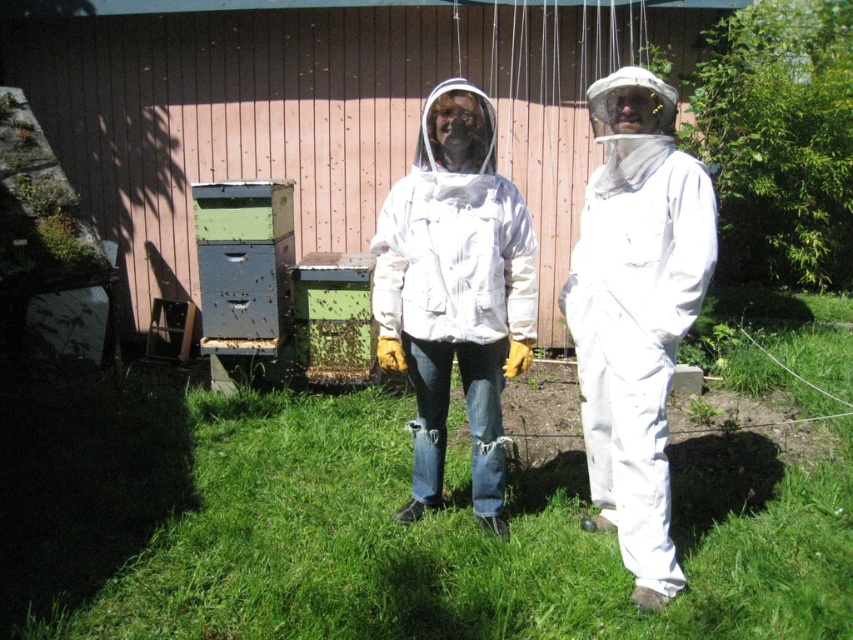
Image resolution: width=853 pixels, height=640 pixels. Describe the element at coordinates (636, 314) in the screenshot. I see `white matte bee suit at center` at that location.

I want to click on white matte bee suit at center, so pyautogui.click(x=636, y=314).

Measure the distance between white matte beekeeping suit at center and camera.

A distance of 3.05 meters exists between white matte beekeeping suit at center and camera.

Is white matte beekeeping suit at center taller than green wooden beehive at center?

Yes, white matte beekeeping suit at center is taller than green wooden beehive at center.

Who is more distant from viewer, (520, 340) or (346, 340)?

Point (346, 340)

Locate an element on the screen. The image size is (853, 640). white matte beekeeping suit at center is located at coordinates (456, 292).

Between white matte bee suit at center and white matte beekeeping suit at center, which one is positioned higher?

white matte beekeeping suit at center is higher up.

Consider the image. Which is more to the right, white matte bee suit at center or white matte beekeeping suit at center?

From the viewer's perspective, white matte bee suit at center appears more on the right side.

Between point (654, 444) and point (415, 384), which one is positioned behind?

The point (415, 384) is behind.

This screenshot has width=853, height=640. Find the location of `white matte bee suit at center`. white matte bee suit at center is located at coordinates (636, 314).